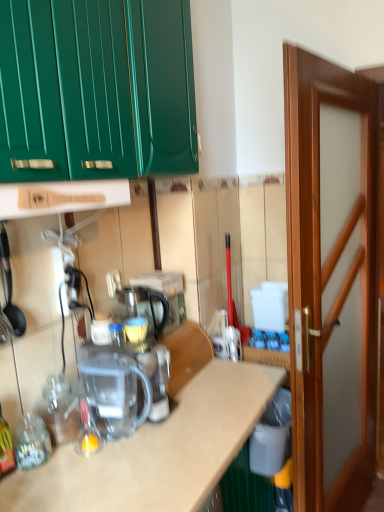
Question: Is transparent plastic coffee machine at center oriented away from wooden door at right?

Choices:
 (A) no
 (B) yes

Answer: (A)

Question: Is transparent plastic coffee machine at center oriented towards wooden door at right?

Choices:
 (A) yes
 (B) no

Answer: (B)

Question: From the image's perspective, is transparent plastic coffee machine at center under wooden door at right?

Choices:
 (A) yes
 (B) no

Answer: (A)

Question: From the image's perspective, is transparent plastic coffee machine at center on top of wooden door at right?

Choices:
 (A) no
 (B) yes

Answer: (A)

Question: Is transparent plastic coffee machine at center bigger than wooden door at right?

Choices:
 (A) yes
 (B) no

Answer: (B)

Question: Considering the positions of point (167, 314) and point (13, 456), is point (167, 314) closer or farther from the camera than point (13, 456)?

Choices:
 (A) closer
 (B) farther

Answer: (B)

Question: From a real-world perspective, is transparent plastic kettle at center physically located above or below translucent glass bottle at lower left, placed as the first bottle when sorted from front to back?

Choices:
 (A) below
 (B) above

Answer: (B)

Question: Considering the relative positions of transparent plastic kettle at center and translucent glass bottle at lower left, marked as the second bottle in a right-to-left arrangement, in the image provided, is transparent plastic kettle at center to the left or to the right of translucent glass bottle at lower left, marked as the second bottle in a right-to-left arrangement,?

Choices:
 (A) right
 (B) left

Answer: (A)

Question: Would you say transparent plastic kettle at center is inside or outside translucent glass bottle at lower left, placed as the first bottle when sorted from front to back?

Choices:
 (A) inside
 (B) outside

Answer: (B)

Question: Is transparent plastic kettle at center in front of or behind wooden at center in the image?

Choices:
 (A) behind
 (B) front

Answer: (A)

Question: Is point (162, 322) positioned closer to the camera than point (177, 465)?

Choices:
 (A) farther
 (B) closer

Answer: (A)

Question: In terms of width, does transparent plastic kettle at center look wider or thinner when compared to wooden at center?

Choices:
 (A) thin
 (B) wide

Answer: (A)

Question: Would you say transparent plastic kettle at center is to the left or to the right of wooden at center in the picture?

Choices:
 (A) right
 (B) left

Answer: (B)

Question: From the image's perspective, is translucent glass bottle at lower left, marked as the second bottle in a right-to-left arrangement, positioned above or below wooden at center?

Choices:
 (A) above
 (B) below

Answer: (A)

Question: From a real-world perspective, relative to wooden at center, is translucent glass bottle at lower left, which is the second bottle from back to front, vertically above or below?

Choices:
 (A) below
 (B) above

Answer: (B)